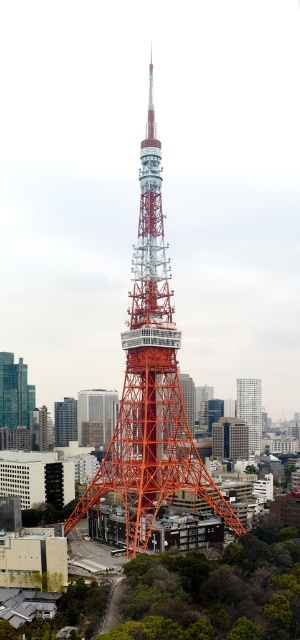
Question: Which point is farther to the camera?

Choices:
 (A) (261, 388)
 (B) (174, 458)

Answer: (A)

Question: Is orange metallic tower at center to the left of white glass building at center-right from the viewer's perspective?

Choices:
 (A) no
 (B) yes

Answer: (B)

Question: Which point appears farthest from the camera in this image?

Choices:
 (A) (243, 417)
 (B) (150, 388)

Answer: (A)

Question: Can you confirm if orange metallic tower at center is positioned below white glass building at center-right?

Choices:
 (A) no
 (B) yes

Answer: (A)

Question: Can you confirm if orange metallic tower at center is bigger than white glass building at center-right?

Choices:
 (A) yes
 (B) no

Answer: (A)